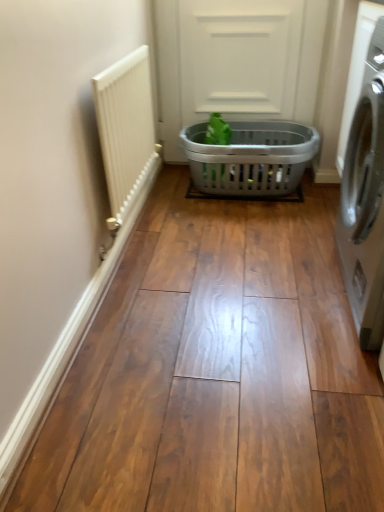
Question: From a real-world perspective, is green matte plant at center positioned under white textured radiator at left based on gravity?

Choices:
 (A) yes
 (B) no

Answer: (A)

Question: Could you tell me if green matte plant at center is turned towards white textured radiator at left?

Choices:
 (A) no
 (B) yes

Answer: (B)

Question: Can you confirm if green matte plant at center is taller than white textured radiator at left?

Choices:
 (A) yes
 (B) no

Answer: (B)

Question: Is green matte plant at center wider than white textured radiator at left?

Choices:
 (A) no
 (B) yes

Answer: (B)

Question: From the image's perspective, does green matte plant at center appear higher than white textured radiator at left?

Choices:
 (A) no
 (B) yes

Answer: (B)

Question: Does green matte plant at center come behind white textured radiator at left?

Choices:
 (A) yes
 (B) no

Answer: (A)

Question: Is gray plastic laundry basket at center positioned before green matte plant at center?

Choices:
 (A) no
 (B) yes

Answer: (B)

Question: Considering the relative sizes of gray plastic laundry basket at center and green matte plant at center in the image provided, is gray plastic laundry basket at center wider than green matte plant at center?

Choices:
 (A) yes
 (B) no

Answer: (A)

Question: Can you confirm if gray plastic laundry basket at center is smaller than green matte plant at center?

Choices:
 (A) no
 (B) yes

Answer: (A)

Question: From the image's perspective, is gray plastic laundry basket at center on green matte plant at center?

Choices:
 (A) yes
 (B) no

Answer: (B)

Question: Does gray plastic laundry basket at center have a lesser height compared to green matte plant at center?

Choices:
 (A) no
 (B) yes

Answer: (A)

Question: Would you say green matte plant at center is part of gray plastic laundry basket at center's contents?

Choices:
 (A) no
 (B) yes

Answer: (B)

Question: Is white textured radiator at left in front of gray plastic laundry basket at center?

Choices:
 (A) no
 (B) yes

Answer: (B)